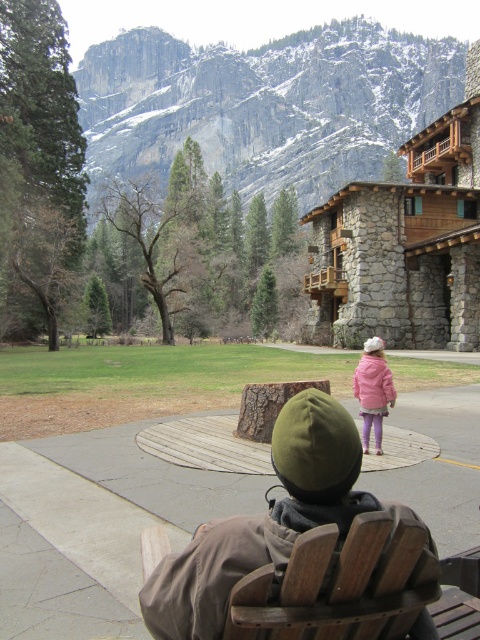
Does wooden chair at center appear over matte pink coat at center?

Actually, wooden chair at center is below matte pink coat at center.

Describe the element at coordinates (344, 584) in the screenshot. Image resolution: width=480 pixels, height=640 pixels. I see `wooden chair at center` at that location.

Is point (360, 620) positioned before point (361, 376)?

Yes.

Where is `wooden chair at center`? The image size is (480, 640). wooden chair at center is located at coordinates (344, 584).

Which is more to the right, dark green knit hat at center or wooden chair at center?

wooden chair at center

Between dark green knit hat at center and wooden chair at center, which one has less height?

With less height is wooden chair at center.

Locate an element on the screen. dark green knit hat at center is located at coordinates (263, 520).

This screenshot has height=640, width=480. In order to click on dark green knit hat at center in this screenshot , I will do [263, 520].

Which of these two, gray rocky mountain at upper center or matte pink coat at center, stands shorter?

matte pink coat at center

Can you confirm if gray rocky mountain at upper center is positioned to the left of matte pink coat at center?

Yes, gray rocky mountain at upper center is to the left of matte pink coat at center.

Which is in front, point (312, 179) or point (384, 406)?

Point (384, 406) is more forward.

Locate an element on the screen. gray rocky mountain at upper center is located at coordinates (264, 106).